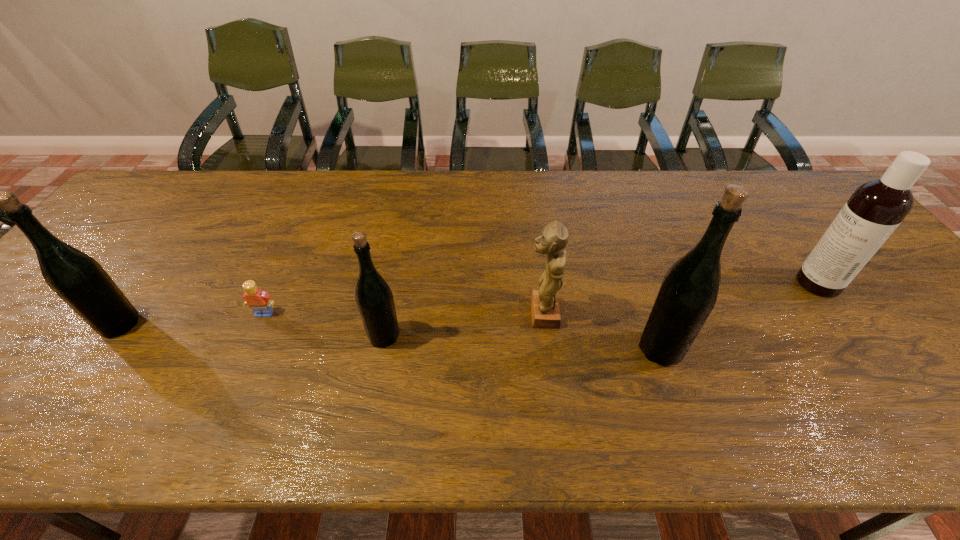
Locate an element on the screen. Image resolution: width=960 pixels, height=540 pixels. the leftmost object is located at coordinates (80, 281).

The height and width of the screenshot is (540, 960). What are the coordinates of `the second shortest beer bottle` in the screenshot? It's located at (80, 281).

Identify the location of the second beer bottle from left to right. (374, 298).

Where is `the shortest beer bottle`? The height and width of the screenshot is (540, 960). the shortest beer bottle is located at coordinates (374, 298).

Locate an element on the screen. This screenshot has width=960, height=540. the rightmost beer bottle is located at coordinates (688, 293).

I want to click on the rightmost object, so click(876, 208).

Image resolution: width=960 pixels, height=540 pixels. I want to click on figurine, so click(553, 239).

What are the coordinates of `the second object from left to right` in the screenshot? It's located at (259, 301).

This screenshot has height=540, width=960. Identify the location of Lego. (259, 301).

At what (x,y) coordinates should I click in order to perform the action: click on vacant region located 0.110m on the back of the second tallest beer bottle. Please return your answer as a coordinate pair (x, y). The height and width of the screenshot is (540, 960). Looking at the image, I should click on (154, 278).